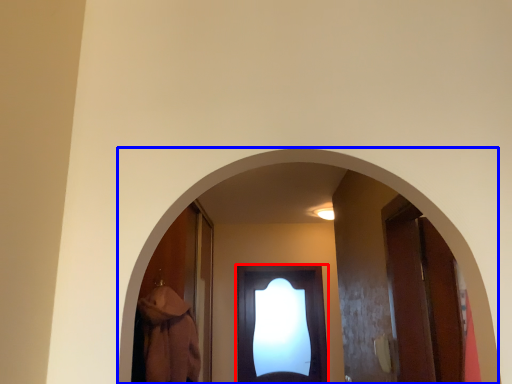
Question: Among these objects, which one is nearest to the camera, door (highlighted by a red box) or archway (highlighted by a blue box)?

Choices:
 (A) door
 (B) archway

Answer: (B)